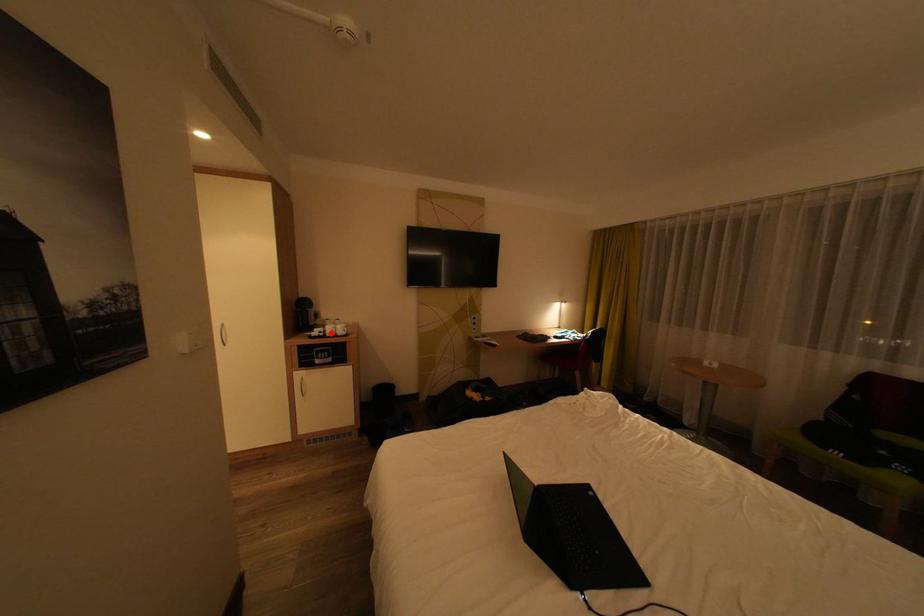
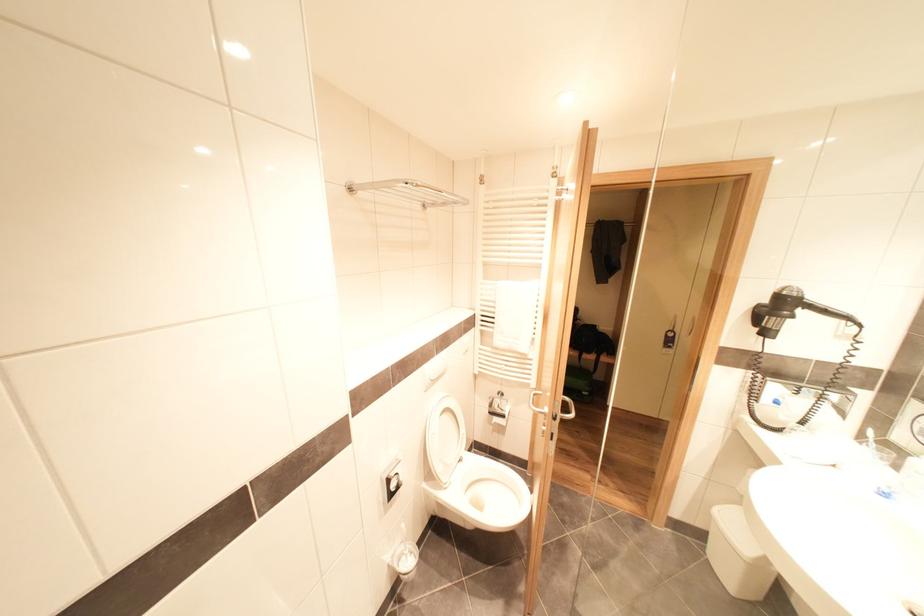
Question: I am providing you with two images of the same scene from different viewpoints. A red point is marked on the first image. Can you still see the location of the red point in image 2?

Choices:
 (A) Yes
 (B) No

Answer: (B)